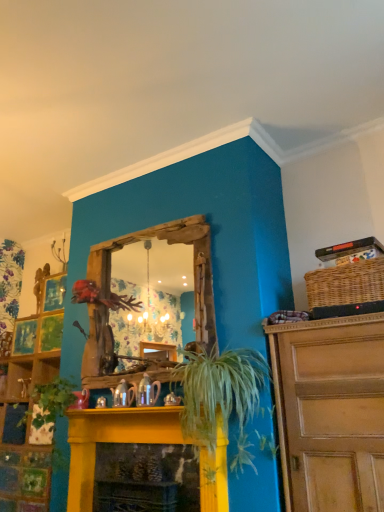
Question: From the image's perspective, is yellow painted wood fireplace at center below green matte plant at lower left?

Choices:
 (A) yes
 (B) no

Answer: (A)

Question: Is yellow painted wood fireplace at center outside green matte plant at lower left?

Choices:
 (A) yes
 (B) no

Answer: (A)

Question: Does yellow painted wood fireplace at center have a greater height compared to green matte plant at lower left?

Choices:
 (A) yes
 (B) no

Answer: (B)

Question: From a real-world perspective, does yellow painted wood fireplace at center stand above green matte plant at lower left?

Choices:
 (A) no
 (B) yes

Answer: (A)

Question: From a real-world perspective, is yellow painted wood fireplace at center positioned under green matte plant at lower left based on gravity?

Choices:
 (A) no
 (B) yes

Answer: (B)

Question: Considering the positions of woven brown basket at upper right and yellow painted wood fireplace at center in the image, is woven brown basket at upper right wider or thinner than yellow painted wood fireplace at center?

Choices:
 (A) wide
 (B) thin

Answer: (A)

Question: Is woven brown basket at upper right inside or outside of yellow painted wood fireplace at center?

Choices:
 (A) inside
 (B) outside

Answer: (B)

Question: Visually, is woven brown basket at upper right positioned to the left or to the right of yellow painted wood fireplace at center?

Choices:
 (A) left
 (B) right

Answer: (B)

Question: Relative to yellow painted wood fireplace at center, is woven brown basket at upper right in front or behind?

Choices:
 (A) behind
 (B) front

Answer: (A)

Question: From a real-world perspective, is yellow painted wood fireplace at center physically located above or below green matte plant at lower left?

Choices:
 (A) below
 (B) above

Answer: (A)

Question: Relative to green matte plant at lower left, is yellow painted wood fireplace at center in front or behind?

Choices:
 (A) front
 (B) behind

Answer: (A)

Question: Considering the positions of yellow painted wood fireplace at center and green matte plant at lower left in the image, is yellow painted wood fireplace at center bigger or smaller than green matte plant at lower left?

Choices:
 (A) big
 (B) small

Answer: (A)

Question: Considering the positions of point (127, 424) and point (57, 456), is point (127, 424) closer or farther from the camera than point (57, 456)?

Choices:
 (A) farther
 (B) closer

Answer: (B)

Question: From the image's perspective, relative to green matte plant at lower left, is green leafy plant at center above or below?

Choices:
 (A) below
 (B) above

Answer: (B)

Question: Visually, is green leafy plant at center positioned to the left or to the right of green matte plant at lower left?

Choices:
 (A) left
 (B) right

Answer: (B)